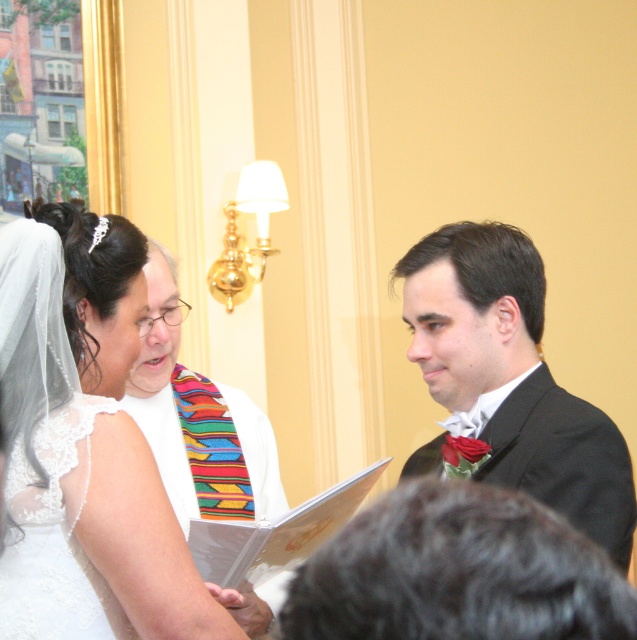
Looking at this image, you are a photographer standing behind the bride and need to adjust the lighting between the black satin suit at center and the matte black suit at center. How far apart are these two suits?

The distance between the black satin suit at center and the matte black suit at center is 3.58 feet.